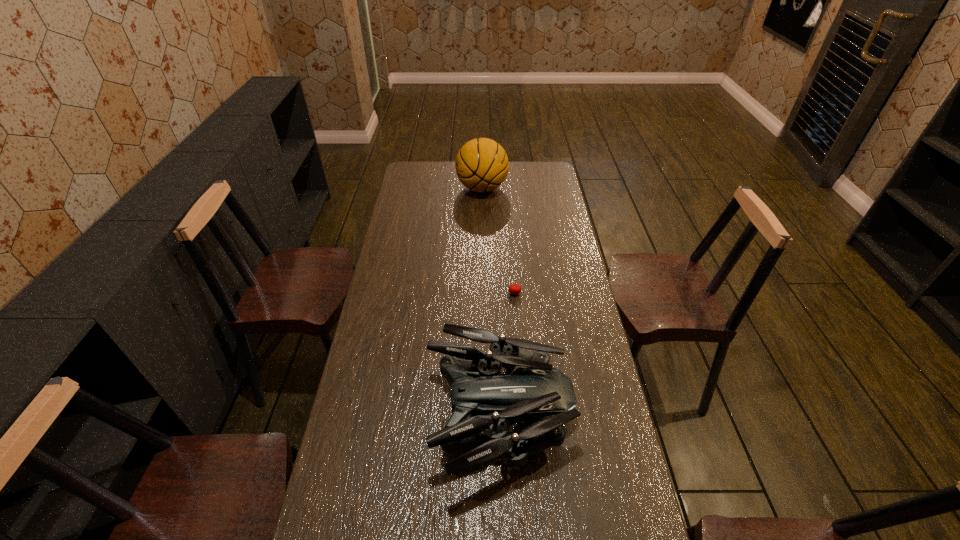
This screenshot has width=960, height=540. I want to click on the farthest object, so click(x=481, y=164).

Locate an element on the screen. The image size is (960, 540). the tallest object is located at coordinates click(x=481, y=164).

Locate an element on the screen. Image resolution: width=960 pixels, height=540 pixels. drone is located at coordinates (482, 399).

The width and height of the screenshot is (960, 540). In order to click on the second tallest object in this screenshot , I will do `click(482, 399)`.

This screenshot has height=540, width=960. In order to click on the second nearest object in this screenshot , I will do `click(514, 289)`.

Find the location of a particular element. the shortest object is located at coordinates (514, 289).

Locate an element on the screen. Image resolution: width=960 pixels, height=540 pixels. free location located on the surface of the tallest object near the brand logo is located at coordinates (408, 188).

Find the location of `free space located 0.280m on the surface of the tallest object near the brand logo`. free space located 0.280m on the surface of the tallest object near the brand logo is located at coordinates (399, 188).

Find the location of a particular element. The height and width of the screenshot is (540, 960). free space located 0.130m on the surface of the tallest object near the brand logo is located at coordinates (430, 188).

Find the location of `free region located on the right of the nearest object`. free region located on the right of the nearest object is located at coordinates (592, 416).